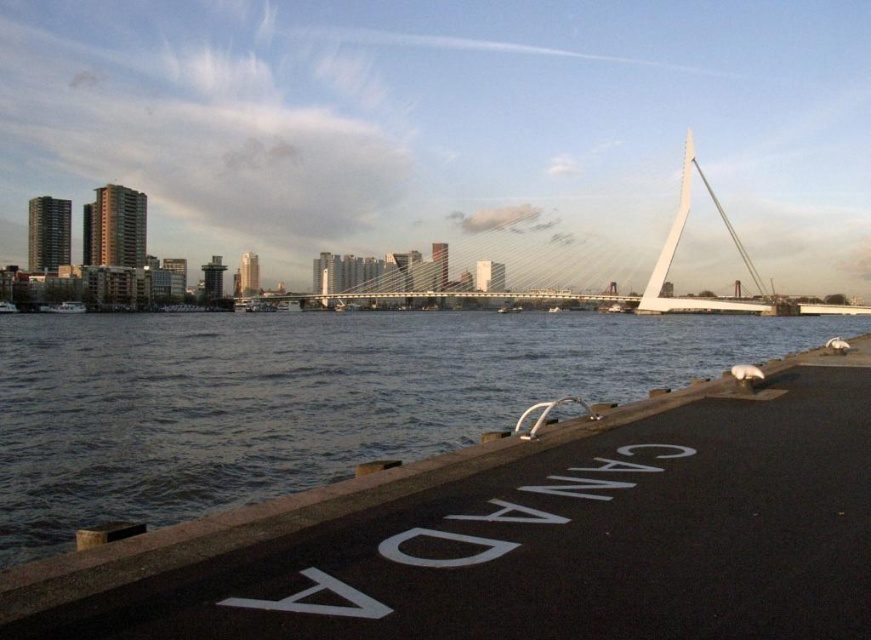
Describe the element at coordinates (525, 536) in the screenshot. Image resolution: width=871 pixels, height=640 pixels. I see `black asphalt dock at lower right` at that location.

Locate an element on the screen. This screenshot has width=871, height=640. black asphalt dock at lower right is located at coordinates (525, 536).

This screenshot has height=640, width=871. I want to click on black asphalt dock at lower right, so click(525, 536).

Between white cable-stayed bridge at center and white matte boat at left, which one has more height?

With more height is white cable-stayed bridge at center.

Describe the element at coordinates (674, 250) in the screenshot. The image size is (871, 640). I see `white cable-stayed bridge at center` at that location.

You are a GUI agent. You are given a task and a screenshot of the screen. Output one action in this format:
    pyautogui.click(x=<x>, y=<y>)
    Task: Click on the white cable-stayed bridge at center
    The height and width of the screenshot is (640, 871).
    Given the screenshot: What is the action you would take?
    click(x=674, y=250)

The height and width of the screenshot is (640, 871). I want to click on black asphalt dock at lower right, so click(x=525, y=536).

Can you confirm if black asphalt dock at lower right is smaller than white matte boat at left?

Correct, black asphalt dock at lower right occupies less space than white matte boat at left.

Does point (319, 493) lie behind point (58, 314)?

No, (319, 493) is closer to viewer.

What are the coordinates of `black asphalt dock at lower right` in the screenshot? It's located at (525, 536).